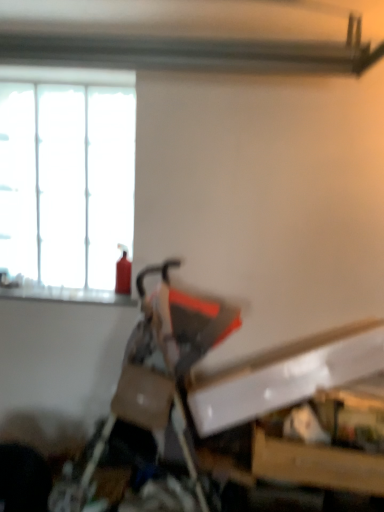
Locate an element on the screen. smooth glass window sill at upper left is located at coordinates (66, 295).

This screenshot has height=512, width=384. Describe the element at coordinates (154, 365) in the screenshot. I see `matte black swivel chair at center` at that location.

Where is `smooth glass window sill at upper left`? This screenshot has height=512, width=384. smooth glass window sill at upper left is located at coordinates (66, 295).

Which is correct: matte black swivel chair at center is inside red matte fire extinguisher at left, or outside of it?

matte black swivel chair at center exists outside the volume of red matte fire extinguisher at left.

Is point (150, 325) positioned before point (125, 285)?

Yes.

Who is taller, matte black swivel chair at center or red matte fire extinguisher at left?

matte black swivel chair at center is taller.

Is smooth glass window sill at upper left positioned behind red matte fire extinguisher at left?

No, it is not.

Can you confirm if smooth glass window sill at upper left is shorter than red matte fire extinguisher at left?

Correct, smooth glass window sill at upper left is not as tall as red matte fire extinguisher at left.

Is smooth glass window sill at upper left touching red matte fire extinguisher at left?

smooth glass window sill at upper left is not next to red matte fire extinguisher at left, and they're not touching.

Between smooth glass window sill at upper left and red matte fire extinguisher at left, which one has smaller size?

red matte fire extinguisher at left is smaller.

Is red matte fire extinguisher at left in front of or behind matte black swivel chair at center in the image?

Clearly, red matte fire extinguisher at left is behind matte black swivel chair at center.

Consider the image. From the image's perspective, who appears lower, red matte fire extinguisher at left or matte black swivel chair at center?

matte black swivel chair at center is shown below in the image.

From a real-world perspective, is red matte fire extinguisher at left on matte black swivel chair at center?

Yes, from a real-world perspective, red matte fire extinguisher at left is on top of matte black swivel chair at center.

Which object is thinner, red matte fire extinguisher at left or matte black swivel chair at center?

Thinner between the two is red matte fire extinguisher at left.

Who is taller, red matte fire extinguisher at left or smooth glass window sill at upper left?

Standing taller between the two is red matte fire extinguisher at left.

Considering the sizes of objects red matte fire extinguisher at left and smooth glass window sill at upper left in the image provided, who is bigger, red matte fire extinguisher at left or smooth glass window sill at upper left?

smooth glass window sill at upper left.

Is red matte fire extinguisher at left oriented towards smooth glass window sill at upper left?

No.

Could you tell me if white frosted glass window at upper left is facing red matte fire extinguisher at left?

Yes, white frosted glass window at upper left faces towards red matte fire extinguisher at left.

Looking at this image, considering the relative sizes of white frosted glass window at upper left and red matte fire extinguisher at left in the image provided, is white frosted glass window at upper left wider than red matte fire extinguisher at left?

No.

Is matte black swivel chair at center completely or partially outside of white frosted glass window at upper left?

Yes, matte black swivel chair at center is outside of white frosted glass window at upper left.

Looking at this image, does matte black swivel chair at center come behind white frosted glass window at upper left?

No.

Which is behind, point (191, 359) or point (43, 291)?

The point (43, 291) is behind.

Is smooth glass window sill at upper left taller or shorter than matte black swivel chair at center?

Considering their sizes, smooth glass window sill at upper left has less height than matte black swivel chair at center.

This screenshot has width=384, height=512. What are the coordinates of `window sill to the left of matte black swivel chair at center` in the screenshot? It's located at (66, 295).

Is smooth glass window sill at upper left far away from matte black swivel chair at center?

No, there isn't a large distance between smooth glass window sill at upper left and matte black swivel chair at center.

The image size is (384, 512). Identify the location of extinguisher on the left of the matte black swivel chair at center. click(123, 272).

In the image, there is a red matte fire extinguisher at left. In order to click on window sill below it (from the image's perspective) in this screenshot , I will do `click(66, 295)`.

Estimate the real-world distances between objects in this image. Which object is further from smooth glass window sill at upper left, red matte fire extinguisher at left or matte black swivel chair at center?

matte black swivel chair at center is further to smooth glass window sill at upper left.

Consider the image. When comparing their distances from matte black swivel chair at center, does white frosted glass window at upper left or smooth glass window sill at upper left seem closer?

smooth glass window sill at upper left lies closer to matte black swivel chair at center than the other object.

From the image, which object appears to be nearer to matte black swivel chair at center, white frosted glass window at upper left or red matte fire extinguisher at left?

red matte fire extinguisher at left lies closer to matte black swivel chair at center than the other object.

Based on their spatial positions, is smooth glass window sill at upper left or white frosted glass window at upper left further from red matte fire extinguisher at left?

white frosted glass window at upper left.

Estimate the real-world distances between objects in this image. Which object is further from white frosted glass window at upper left, red matte fire extinguisher at left or smooth glass window sill at upper left?

red matte fire extinguisher at left lies further to white frosted glass window at upper left than the other object.

Based on their spatial positions, is red matte fire extinguisher at left or white frosted glass window at upper left further from matte black swivel chair at center?

white frosted glass window at upper left is further to matte black swivel chair at center.

Estimate the real-world distances between objects in this image. Which object is closer to smooth glass window sill at upper left, white frosted glass window at upper left or red matte fire extinguisher at left?

red matte fire extinguisher at left lies closer to smooth glass window sill at upper left than the other object.

Estimate the real-world distances between objects in this image. Which object is further from smooth glass window sill at upper left, matte black swivel chair at center or white frosted glass window at upper left?

matte black swivel chair at center is positioned further to the anchor smooth glass window sill at upper left.

Locate an element on the screen. This screenshot has height=512, width=384. window sill between white frosted glass window at upper left and matte black swivel chair at center from top to bottom is located at coordinates (66, 295).

Locate an element on the screen. window sill located between matte black swivel chair at center and red matte fire extinguisher at left in the depth direction is located at coordinates coord(66,295).

Identify the location of extinguisher between white frosted glass window at upper left and smooth glass window sill at upper left in the vertical direction. point(123,272).

Image resolution: width=384 pixels, height=512 pixels. In order to click on extinguisher between white frosted glass window at upper left and matte black swivel chair at center in the up-down direction in this screenshot , I will do `click(123, 272)`.